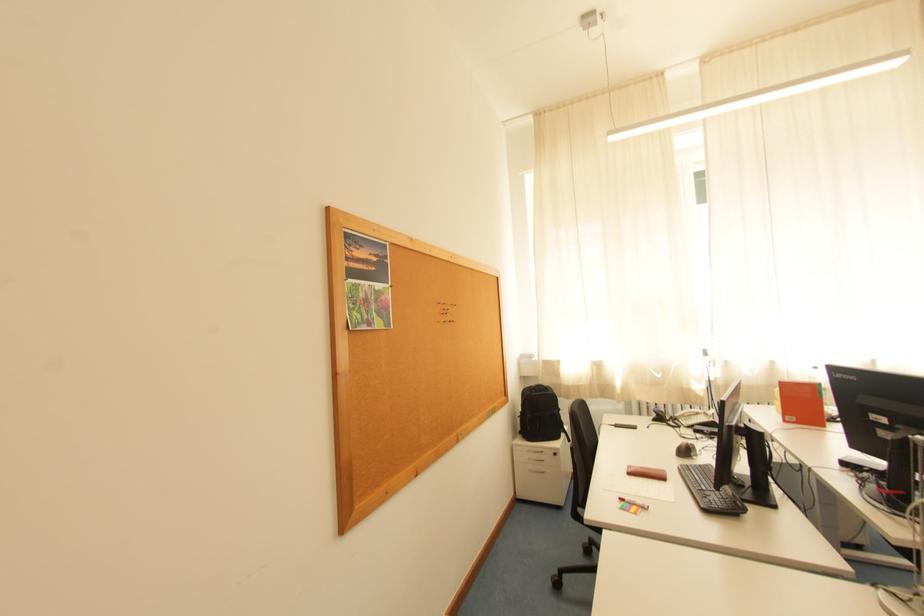
At what (x,y) coordinates should I click in order to perform the action: click on chair armrest. Please return your answer as a coordinate pair (x, y). This screenshot has height=616, width=924. Looking at the image, I should click on (579, 493).